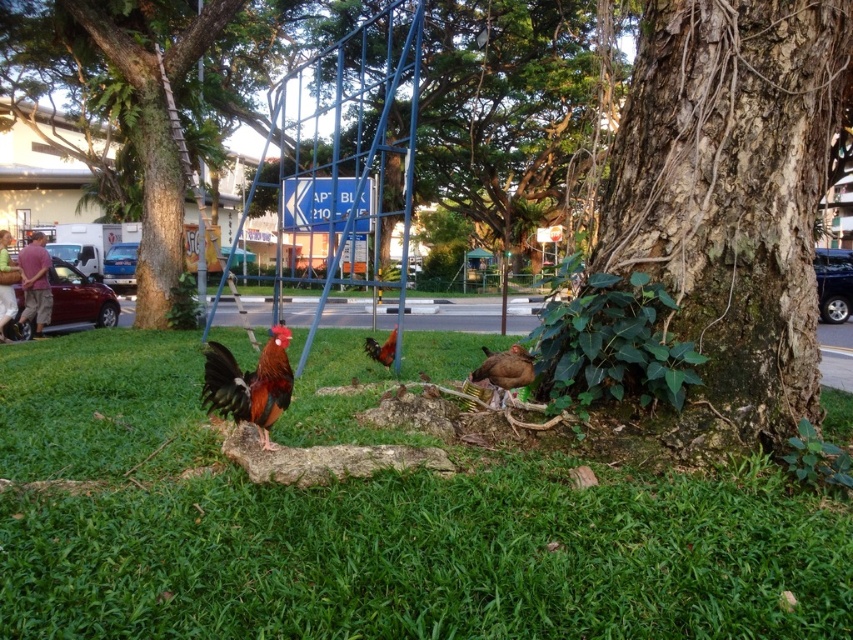
You are a child visiting the park and want to play on the swing set. You see the smooth bark tree at lower right and the brown glossy chicken at center. Which object is bigger?

The smooth bark tree at lower right is larger in size compared to the brown glossy chicken at center.

You are a bird enthusiast trying to observe the shiny brown chicken at center and the brown matte chicken at lower center from a distance of 5 feet. Can you comfortably see both chickens without moving closer than 5 feet?

The shiny brown chicken at center is 3.64 feet away from the brown matte chicken at lower center. Since you are observing from 5 feet away, you can comfortably see both chickens without moving closer than 5 feet because the distance between them is less than your observation distance.

You are standing at the origin point of the coordinate system in the image. You want to walk directly to the shiny brown chicken at center. What direction should you head towards?

The shiny brown chicken at center is located at coordinates point (248, 384). Since the x coordinate is 0.600 which is greater than 0.5, you should head towards the right direction. The y coordinate is 0.293 which is less than 0.5, so you should head downward. Therefore, you should move towards the lower right direction to reach the shiny brown chicken at center.